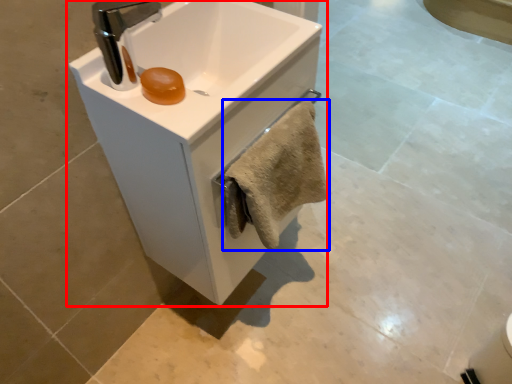
Question: Which object appears closest to the camera in this image, sink (highlighted by a red box) or bath towel (highlighted by a blue box)?

Choices:
 (A) sink
 (B) bath towel

Answer: (A)